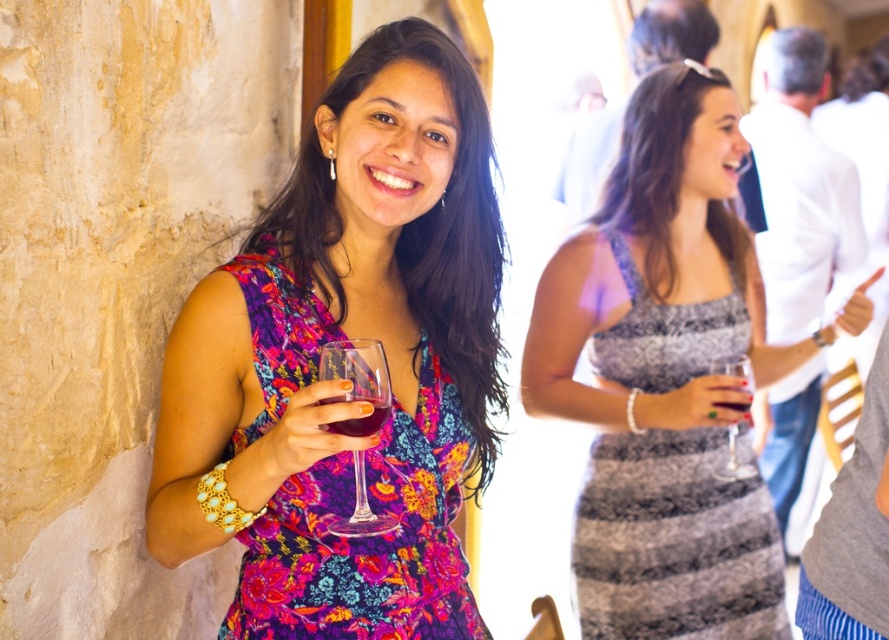
You are a photographer at the event and want to capture a closeup of the gray lace dress at upper center without the translucent glass wine at center appearing in the frame. Is this possible given their sizes?

The gray lace dress at upper center is larger in size than the translucent glass wine at center, so adjusting the camera angle to focus on the dress while excluding the wine glass may be feasible since the dress is bigger and could block the view of the smaller glass.

You are a photographer at this event and want to capture a photo of both the floral fabric dress at center and the gray lace dress at upper center. Which dress will appear shorter in the photo?

The floral fabric dress at center will appear shorter in the photo because it is shorter than the gray lace dress at upper center.